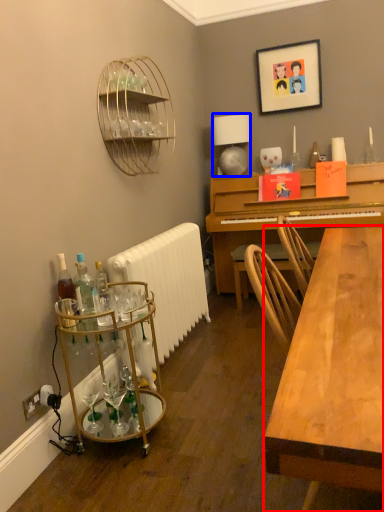
Question: Which point is further to the camera, desk (highlighted by a red box) or lamp (highlighted by a blue box)?

Choices:
 (A) desk
 (B) lamp

Answer: (B)